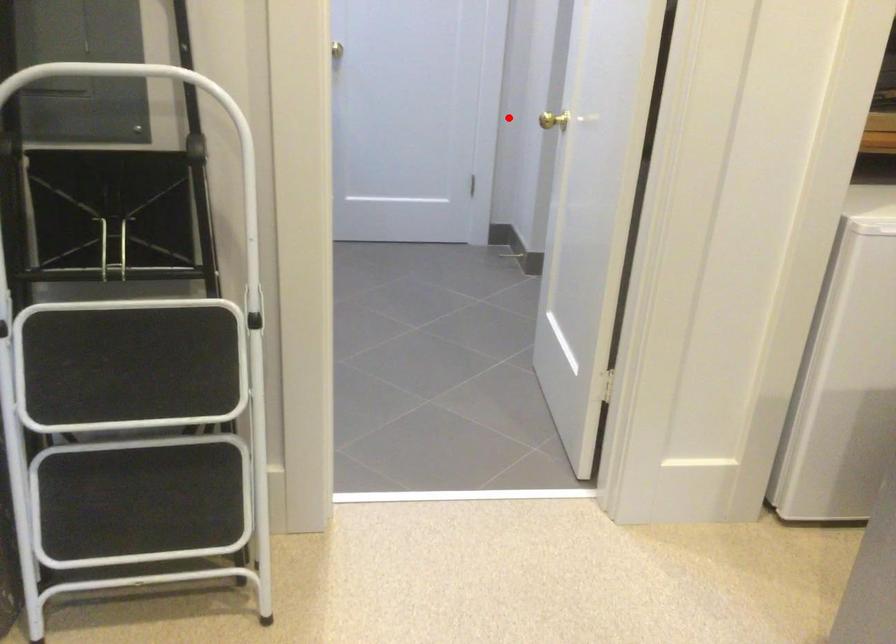
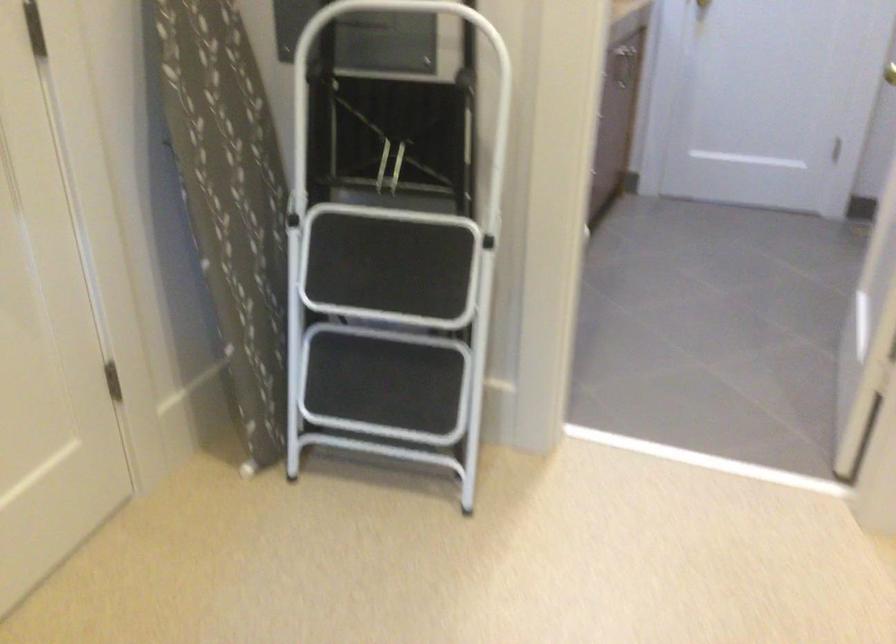
Question: I am providing you with two images of the same scene from different viewpoints. Image1 has a red point marked. In image2, the corresponding 3D location appears at what relative position? Reply with the corresponding letter.

Choices:
 (A) Closer
 (B) Farther

Answer: (A)